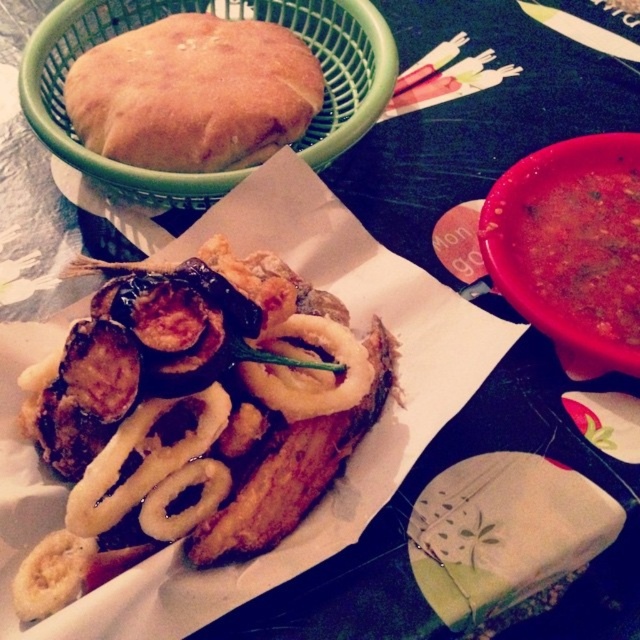
Can you confirm if golden crispy onion rings at center is shorter than golden brown bread at upper left?

No, golden crispy onion rings at center is not shorter than golden brown bread at upper left.

Which of these two, golden crispy onion rings at center or golden brown bread at upper left, stands shorter?

With less height is golden brown bread at upper left.

The height and width of the screenshot is (640, 640). I want to click on golden crispy onion rings at center, so click(193, 416).

Where is `golden crispy onion rings at center`? The width and height of the screenshot is (640, 640). golden crispy onion rings at center is located at coordinates (193, 416).

Which is behind, point (120, 300) or point (570, 304)?

The point (570, 304) is behind.

Which is in front, point (102, 310) or point (632, 188)?

Point (102, 310)

Where is `golden crispy onion rings at center`? golden crispy onion rings at center is located at coordinates (193, 416).

The width and height of the screenshot is (640, 640). What are the coordinates of `golden crispy onion rings at center` in the screenshot? It's located at (193, 416).

Can you confirm if golden brown bread at upper left is wider than thick tomato soup at right?

Yes, golden brown bread at upper left is wider than thick tomato soup at right.

Which is behind, point (172, 86) or point (596, 252)?

The point (172, 86) is more distant.

Describe the element at coordinates (193, 93) in the screenshot. I see `golden brown bread at upper left` at that location.

The width and height of the screenshot is (640, 640). Identify the location of golden brown bread at upper left. (193, 93).